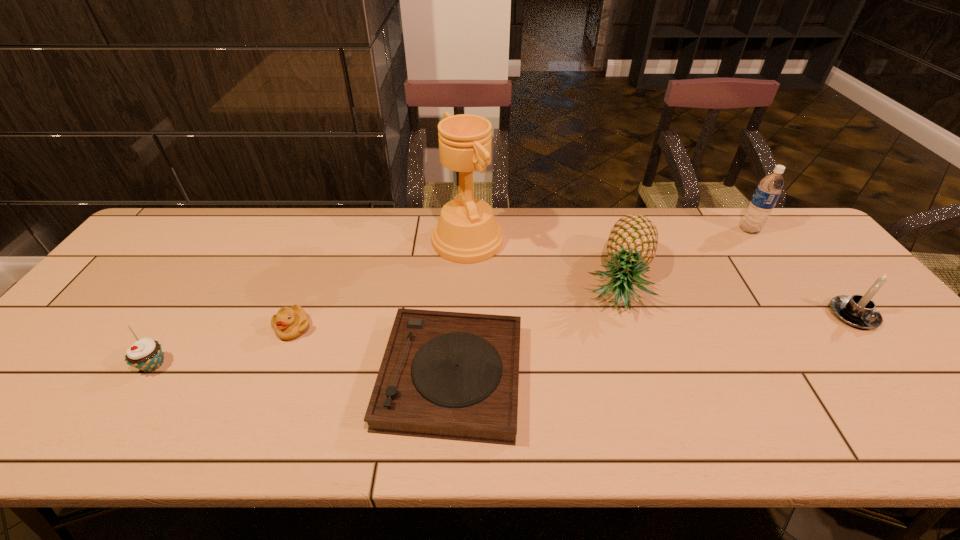
Locate which object ranks in proximity to the water bottle. Please provide its 2D coordinates. Your answer should be formatted as a tuple, i.e. [(x, y)], where the tuple contains the x and y coordinates of a point satisfying the conditions above.

[(859, 311)]

Identify the location of free location that satisfies the following two spatial constraints: 1. on the back side of the water bottle; 2. on the left side of the third object from right to left. The width and height of the screenshot is (960, 540). (602, 230).

What are the coordinates of `free space in the image that satisfies the following two spatial constraints: 1. on the front-facing side of the second shortest object; 2. on the left side of the phonograph record` in the screenshot? It's located at (274, 376).